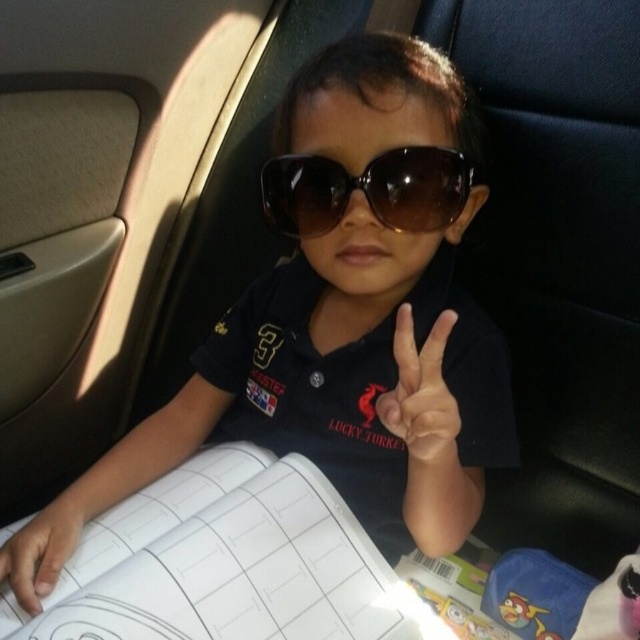
This screenshot has height=640, width=640. What do you see at coordinates (368, 189) in the screenshot? I see `brown matte sunglasses at center` at bounding box center [368, 189].

Which is more to the left, brown matte sunglasses at center or smooth skin hand at lower left?

Positioned to the left is smooth skin hand at lower left.

Does point (346, 196) come behind point (74, 531)?

No, it is in front of (74, 531).

At what (x,y) coordinates should I click in order to perform the action: click on brown matte sunglasses at center. Please return your answer as a coordinate pair (x, y). Looking at the image, I should click on (368, 189).

From the picture: Between matte black hand at center and smooth skin hand at lower left, which one has more height?

With more height is matte black hand at center.

The height and width of the screenshot is (640, 640). I want to click on matte black hand at center, so click(x=420, y=396).

Locate an element on the screen. matte black hand at center is located at coordinates (420, 396).

Who is more distant from viewer, (422, 204) or (444, 349)?

Positioned behind is point (422, 204).

Does brown matte sunglasses at center have a greater height compared to matte black hand at center?

In fact, brown matte sunglasses at center may be shorter than matte black hand at center.

This screenshot has width=640, height=640. I want to click on brown matte sunglasses at center, so click(368, 189).